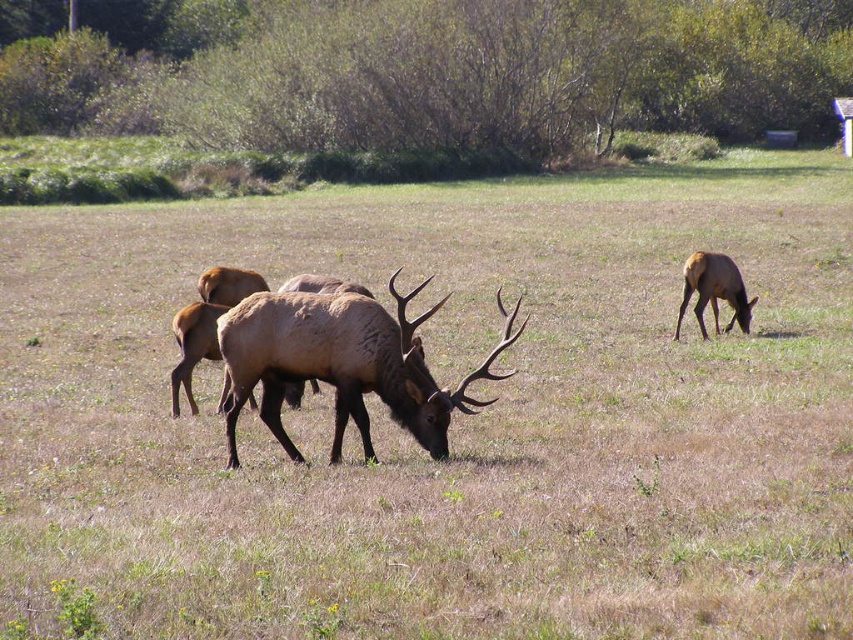
Is brown velvet antlers at center smaller than brown matte/deer at right?

Actually, brown velvet antlers at center might be larger than brown matte/deer at right.

Between brown velvet antlers at center and brown matte/deer at right, which one has more height?

brown velvet antlers at center

Where is `brown velvet antlers at center`? This screenshot has height=640, width=853. brown velvet antlers at center is located at coordinates (341, 364).